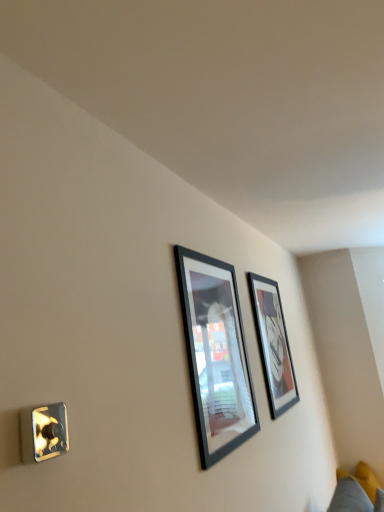
Question: Considering the relative sizes of yellow fabric couch at lower right and matte black picture frame at upper center, positioned as the 1th picture frame in right-to-left order, in the image provided, is yellow fabric couch at lower right bigger than matte black picture frame at upper center, positioned as the 1th picture frame in right-to-left order,?

Choices:
 (A) yes
 (B) no

Answer: (A)

Question: From a real-world perspective, does yellow fabric couch at lower right sit lower than matte black picture frame at upper center, the 2th picture frame from the left?

Choices:
 (A) yes
 (B) no

Answer: (A)

Question: Can you confirm if yellow fabric couch at lower right is shorter than matte black picture frame at upper center, which appears as the 2th picture frame when viewed from the front?

Choices:
 (A) yes
 (B) no

Answer: (A)

Question: Is yellow fabric couch at lower right aimed at matte black picture frame at upper center, which is the 1th picture frame in back-to-front order?

Choices:
 (A) yes
 (B) no

Answer: (B)

Question: Does yellow fabric couch at lower right lie behind matte black picture frame at upper center, positioned as the 1th picture frame in right-to-left order?

Choices:
 (A) yes
 (B) no

Answer: (A)

Question: Is yellow fabric couch at lower right taller or shorter than matte black picture frame at upper center, positioned as the 1th picture frame in right-to-left order?

Choices:
 (A) short
 (B) tall

Answer: (A)

Question: In the image, is yellow fabric couch at lower right positioned in front of or behind matte black picture frame at upper center, which is the 1th picture frame in back-to-front order?

Choices:
 (A) behind
 (B) front

Answer: (A)

Question: Looking at the image, does yellow fabric couch at lower right seem bigger or smaller compared to matte black picture frame at upper center, the 2th picture frame from the left?

Choices:
 (A) small
 (B) big

Answer: (B)

Question: Is point (x=347, y=501) positioned closer to the camera than point (x=253, y=303)?

Choices:
 (A) farther
 (B) closer

Answer: (A)

Question: Considering the positions of point (251, 279) and point (228, 282), is point (251, 279) closer or farther from the camera than point (228, 282)?

Choices:
 (A) closer
 (B) farther

Answer: (B)

Question: In terms of size, does matte black picture frame at upper center, positioned as the 1th picture frame in right-to-left order, appear bigger or smaller than black glossy picture frame at center, the second picture frame from the back?

Choices:
 (A) small
 (B) big

Answer: (A)

Question: From the image's perspective, relative to black glossy picture frame at center, the first picture frame from the front, is matte black picture frame at upper center, the 2th picture frame from the left, above or below?

Choices:
 (A) above
 (B) below

Answer: (B)

Question: From their relative heights in the image, would you say matte black picture frame at upper center, the 2th picture frame from the left, is taller or shorter than black glossy picture frame at center, the first picture frame from the front?

Choices:
 (A) tall
 (B) short

Answer: (A)

Question: Is matte black picture frame at upper center, the 2th picture frame from the left, situated inside yellow fabric couch at lower right or outside?

Choices:
 (A) inside
 (B) outside

Answer: (B)

Question: Is matte black picture frame at upper center, which appears as the 2th picture frame when viewed from the front, in front of or behind yellow fabric couch at lower right in the image?

Choices:
 (A) behind
 (B) front

Answer: (B)